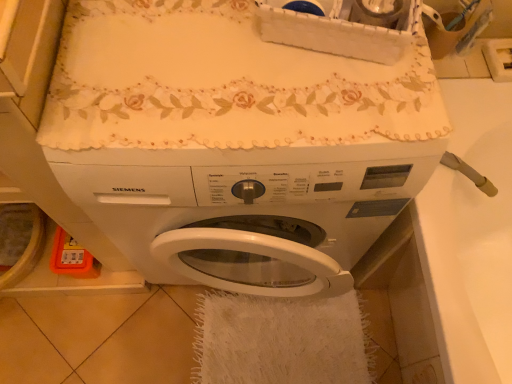
Question: Is white fluffy bath towel at lower center bigger than white glossy sink at right?

Choices:
 (A) no
 (B) yes

Answer: (A)

Question: Is white fluffy bath towel at lower center oriented away from white glossy sink at right?

Choices:
 (A) no
 (B) yes

Answer: (B)

Question: From the image's perspective, would you say white fluffy bath towel at lower center is shown under white glossy sink at right?

Choices:
 (A) no
 (B) yes

Answer: (B)

Question: Is white fluffy bath towel at lower center taller than white glossy sink at right?

Choices:
 (A) no
 (B) yes

Answer: (A)

Question: Does white fluffy bath towel at lower center come in front of white glossy sink at right?

Choices:
 (A) no
 (B) yes

Answer: (A)

Question: In the image, is white matte washing machine at center positioned in front of or behind white fluffy bath towel at lower center?

Choices:
 (A) front
 (B) behind

Answer: (A)

Question: Looking at their shapes, would you say white matte washing machine at center is wider or thinner than white fluffy bath towel at lower center?

Choices:
 (A) thin
 (B) wide

Answer: (A)

Question: Is point (346, 97) closer or farther from the camera than point (325, 360)?

Choices:
 (A) closer
 (B) farther

Answer: (A)

Question: Considering the positions of white matte washing machine at center and white fluffy bath towel at lower center in the image, is white matte washing machine at center taller or shorter than white fluffy bath towel at lower center?

Choices:
 (A) short
 (B) tall

Answer: (B)

Question: Is white fluffy bath towel at lower center to the left or to the right of white glossy sink at right in the image?

Choices:
 (A) right
 (B) left

Answer: (B)

Question: Is white fluffy bath towel at lower center wider or thinner than white glossy sink at right?

Choices:
 (A) wide
 (B) thin

Answer: (B)

Question: From a real-world perspective, is white fluffy bath towel at lower center physically located above or below white glossy sink at right?

Choices:
 (A) above
 (B) below

Answer: (B)

Question: Based on their sizes in the image, would you say white fluffy bath towel at lower center is bigger or smaller than white glossy sink at right?

Choices:
 (A) big
 (B) small

Answer: (B)

Question: In terms of height, does white glossy sink at right look taller or shorter compared to white matte washing machine at center?

Choices:
 (A) short
 (B) tall

Answer: (A)

Question: Is white glossy sink at right bigger or smaller than white matte washing machine at center?

Choices:
 (A) big
 (B) small

Answer: (B)